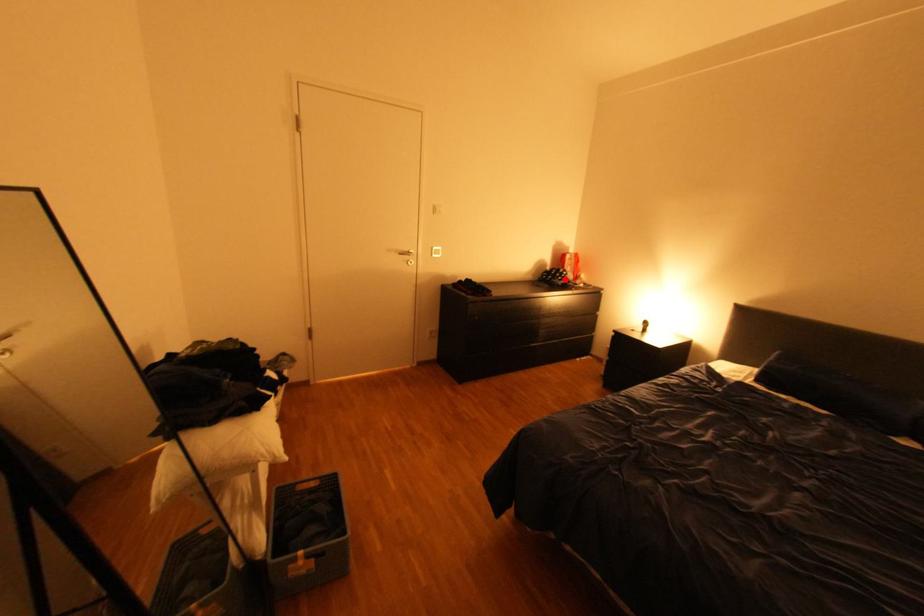
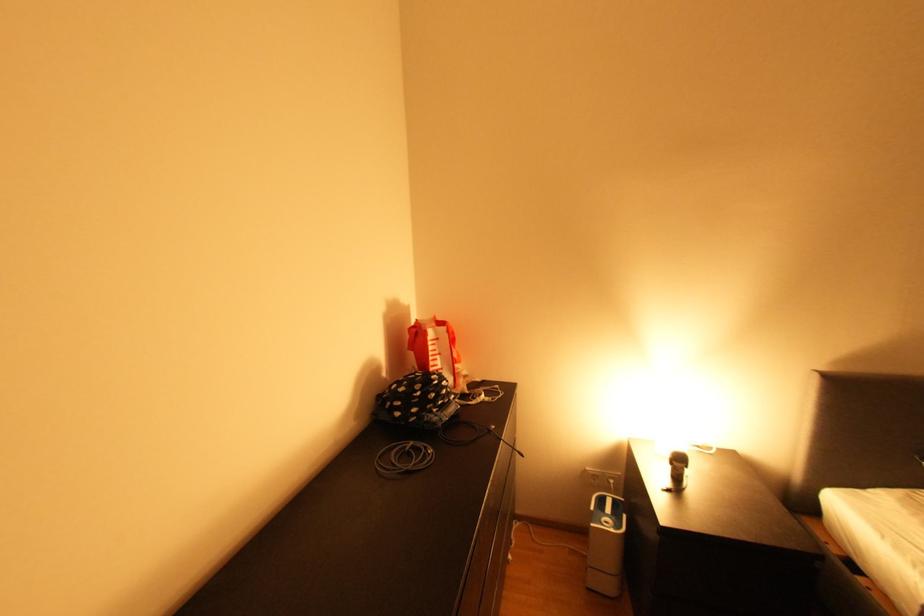
Question: I am providing you with two images of the same scene from different viewpoints. Image1 has a red point marked. In image2, the corresponding 3D location appears at what relative position? Reply with the corresponding letter.

Choices:
 (A) Closer
 (B) Farther

Answer: (B)